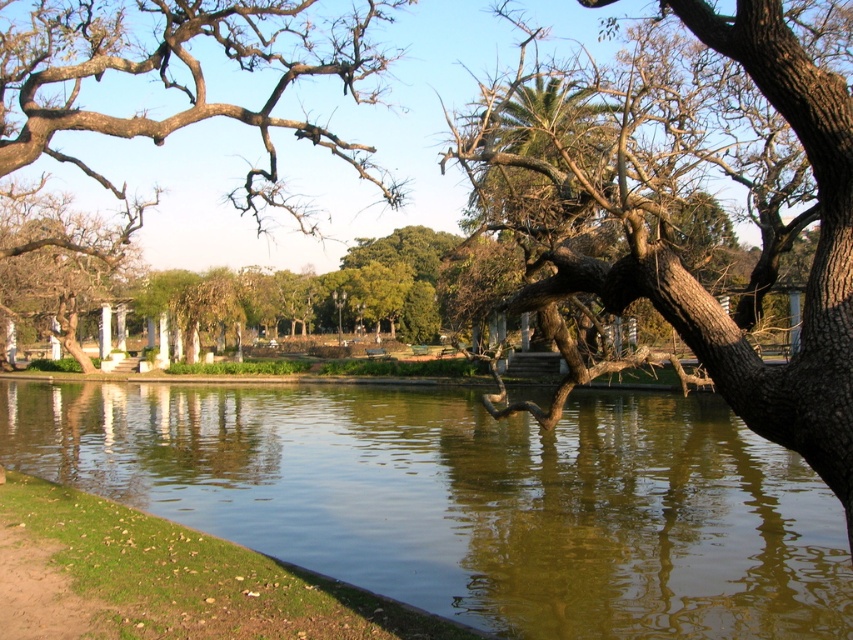
Is point (380, 413) in front of point (796, 420)?

That is False.

Does point (564, 493) come in front of point (775, 26)?

No, it is behind (775, 26).

Find the location of a particular element. This screenshot has height=640, width=853. green reflective water at center is located at coordinates (471, 499).

Which of these two, brown textured bark at center or brown rough tree at upper left, stands taller?

brown rough tree at upper left

Between point (764, 36) and point (9, 131), which one is positioned behind?

Point (9, 131)

Image resolution: width=853 pixels, height=640 pixels. I want to click on brown textured bark at center, so click(x=715, y=300).

Does brown rough tree at upper left appear on the left side of brown wood tree at left?

No, brown rough tree at upper left is not to the left of brown wood tree at left.

Can you confirm if brown rough tree at upper left is smaller than brown wood tree at left?

Incorrect, brown rough tree at upper left is not smaller in size than brown wood tree at left.

Is point (299, 80) closer to camera compared to point (1, 262)?

No, it is behind (1, 262).

Image resolution: width=853 pixels, height=640 pixels. Identify the location of brown rough tree at upper left. [181, 80].